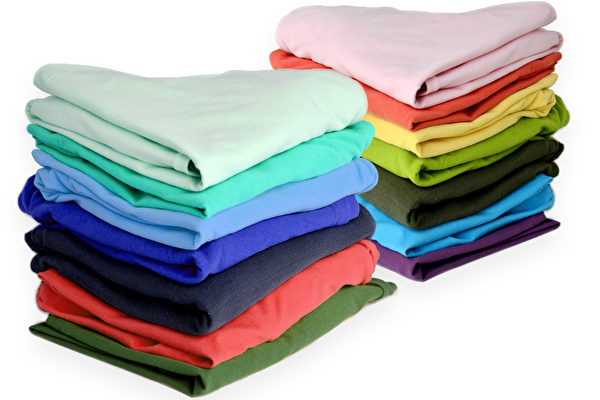
Where is `folded clothing on the left`? folded clothing on the left is located at coordinates (232, 371), (227, 342), (214, 301), (207, 261), (217, 228), (219, 203), (217, 156).